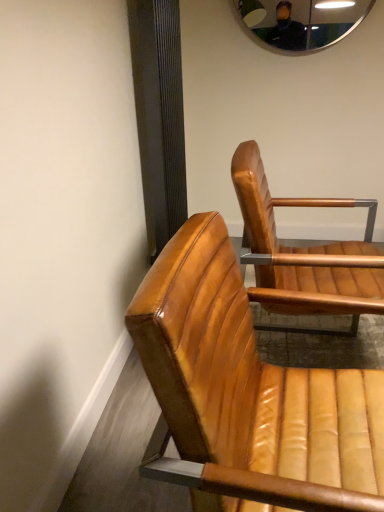
Question: Could leather chair at lower right, which is the 1th chair in front-to-back order, be considered to be inside metallic reflective mirror at upper center?

Choices:
 (A) yes
 (B) no

Answer: (B)

Question: Could you tell me if metallic reflective mirror at upper center is turned towards leather chair at lower right, positioned as the second chair in back-to-front order?

Choices:
 (A) no
 (B) yes

Answer: (A)

Question: From the image's perspective, does metallic reflective mirror at upper center appear lower than leather chair at lower right, positioned as the second chair in back-to-front order?

Choices:
 (A) no
 (B) yes

Answer: (A)

Question: Is metallic reflective mirror at upper center facing away from leather chair at lower right, positioned as the second chair in back-to-front order?

Choices:
 (A) no
 (B) yes

Answer: (A)

Question: Does metallic reflective mirror at upper center have a smaller size compared to leather chair at lower right, which is the 1th chair in front-to-back order?

Choices:
 (A) no
 (B) yes

Answer: (B)

Question: Would you say metallic reflective mirror at upper center is a long distance from leather chair at lower right, positioned as the second chair in back-to-front order?

Choices:
 (A) yes
 (B) no

Answer: (A)

Question: Does metallic reflective mirror at upper center have a lesser height compared to leather tan chair at center, positioned as the 1th chair in back-to-front order?

Choices:
 (A) yes
 (B) no

Answer: (A)

Question: Is metallic reflective mirror at upper center bigger than leather tan chair at center, the second chair viewed from the front?

Choices:
 (A) yes
 (B) no

Answer: (B)

Question: From the image's perspective, is metallic reflective mirror at upper center located beneath leather tan chair at center, the second chair viewed from the front?

Choices:
 (A) no
 (B) yes

Answer: (A)

Question: Could you tell me if metallic reflective mirror at upper center is facing leather tan chair at center, the second chair viewed from the front?

Choices:
 (A) yes
 (B) no

Answer: (B)

Question: Can we say metallic reflective mirror at upper center lies outside leather tan chair at center, the second chair viewed from the front?

Choices:
 (A) no
 (B) yes

Answer: (B)

Question: Is metallic reflective mirror at upper center positioned in front of leather tan chair at center, the second chair viewed from the front?

Choices:
 (A) yes
 (B) no

Answer: (B)

Question: Is leather chair at lower right, positioned as the second chair in back-to-front order, positioned before metallic reflective mirror at upper center?

Choices:
 (A) no
 (B) yes

Answer: (B)